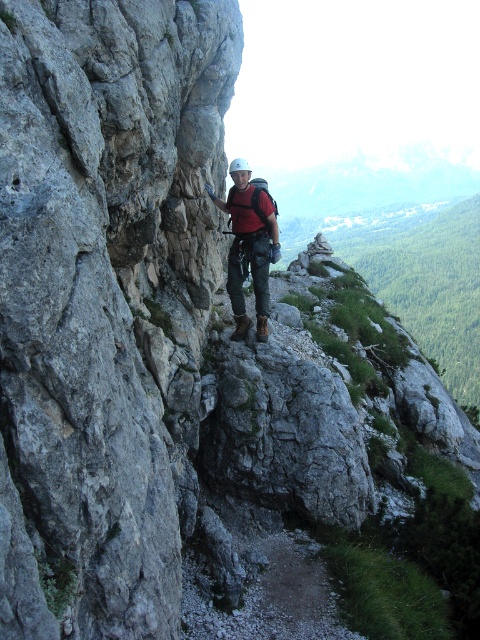
Based on the photo, you are a hiker planning to climb the gray rough rock face at center. You notice the matte red shirt at center nearby. Considering their sizes, which object takes up more space in the image?

The gray rough rock face at center takes up more space in the image because its width is larger than the matte red shirt at center.

Based on the coordinates provided in the description, where is the gray rough rock face at center located in the image?

The gray rough rock face at center is located at point coordinates of [105,301].